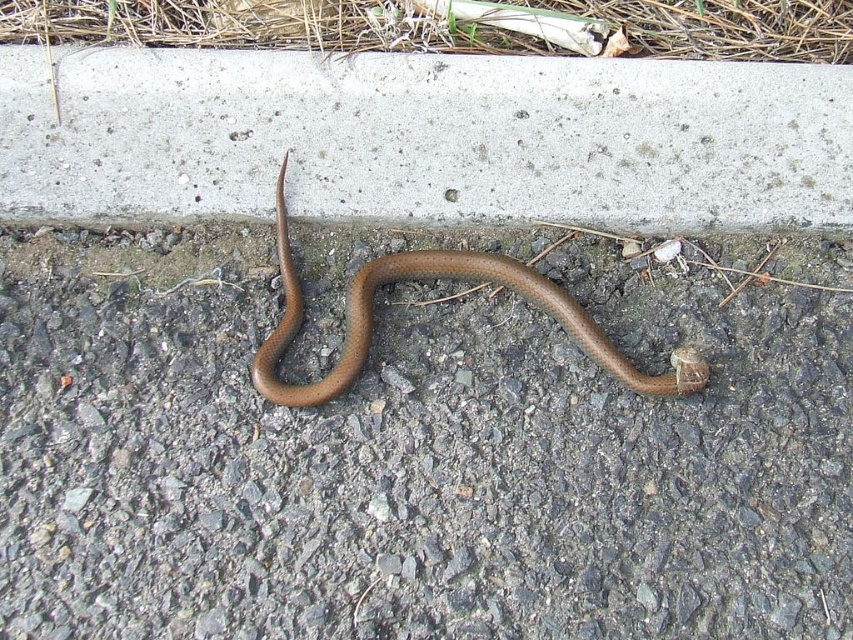
Is brown rubber snake at lower center shorter than gray concrete curb at upper center?

No, brown rubber snake at lower center is not shorter than gray concrete curb at upper center.

Find the location of a particular element. brown rubber snake at lower center is located at coordinates (415, 454).

Can you confirm if brown rubber snake at lower center is positioned below brown matte snake at center?

Yes.

Describe the element at coordinates (415, 454) in the screenshot. I see `brown rubber snake at lower center` at that location.

The image size is (853, 640). In order to click on brown rubber snake at lower center in this screenshot , I will do `click(415, 454)`.

Does brown rubber snake at lower center lie in front of green grass at upper center?

That is True.

The width and height of the screenshot is (853, 640). Identify the location of brown rubber snake at lower center. (415, 454).